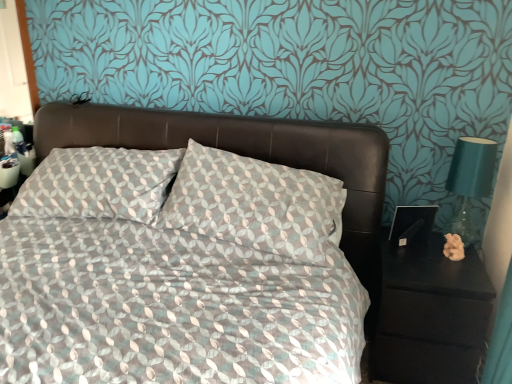
Question: Should I look upward or downward to see patterned fabric bed at center?

Choices:
 (A) up
 (B) down

Answer: (B)

Question: From the image's perspective, is teal glass lamp at right located above patterned fabric bed at center?

Choices:
 (A) no
 (B) yes

Answer: (B)

Question: Can you see teal glass lamp at right touching patterned fabric bed at center?

Choices:
 (A) no
 (B) yes

Answer: (A)

Question: From the image's perspective, does teal glass lamp at right appear lower than patterned fabric bed at center?

Choices:
 (A) yes
 (B) no

Answer: (B)

Question: Does teal glass lamp at right have a greater width compared to patterned fabric bed at center?

Choices:
 (A) no
 (B) yes

Answer: (A)

Question: Does teal glass lamp at right have a larger size compared to patterned fabric bed at center?

Choices:
 (A) no
 (B) yes

Answer: (A)

Question: Is teal glass lamp at right aimed at patterned fabric bed at center?

Choices:
 (A) no
 (B) yes

Answer: (A)

Question: Is patterned fabric bed at center oriented away from teal glass lamp at right?

Choices:
 (A) no
 (B) yes

Answer: (A)

Question: Is patterned fabric bed at center directly adjacent to teal glass lamp at right?

Choices:
 (A) no
 (B) yes

Answer: (A)

Question: From a real-world perspective, is patterned fabric bed at center located higher than teal glass lamp at right?

Choices:
 (A) no
 (B) yes

Answer: (A)

Question: Is patterned fabric bed at center taller than teal glass lamp at right?

Choices:
 (A) no
 (B) yes

Answer: (B)

Question: Is patterned fabric bed at center wider than teal glass lamp at right?

Choices:
 (A) no
 (B) yes

Answer: (B)

Question: Would you say patterned fabric bed at center contains teal glass lamp at right?

Choices:
 (A) no
 (B) yes

Answer: (A)

Question: From a real-world perspective, is patterned fabric bed at center on top of black matte nightstand at right?

Choices:
 (A) no
 (B) yes

Answer: (B)